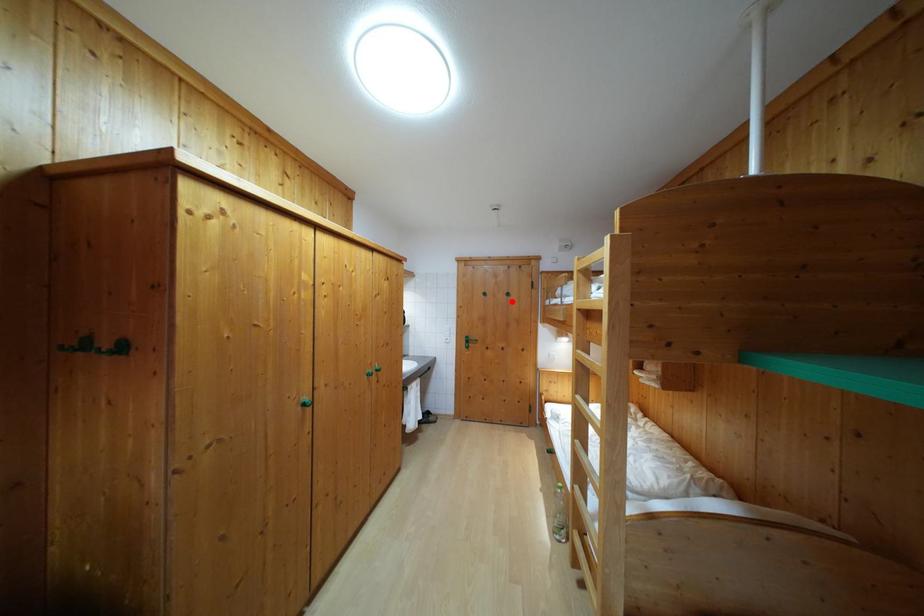
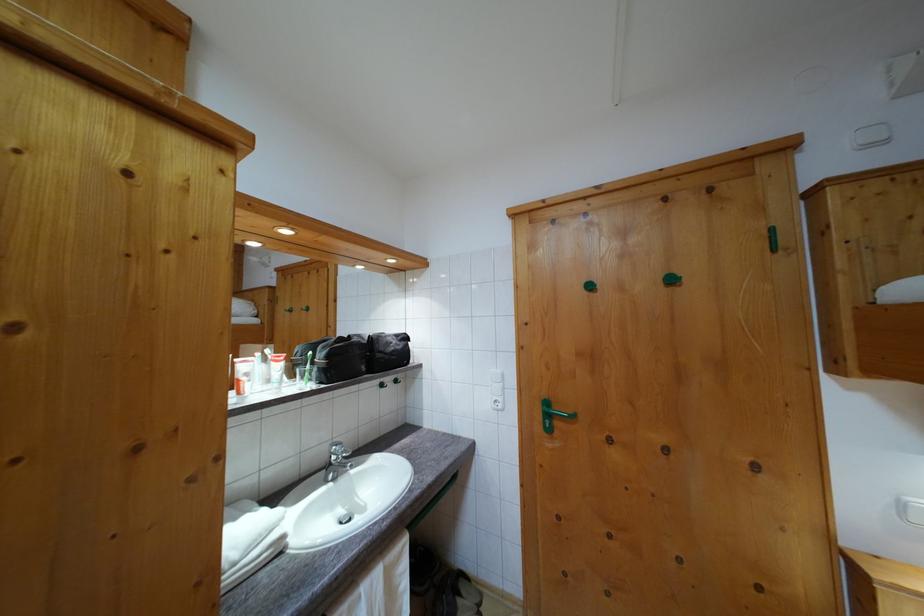
In the second image, find the point that corresponds to the highlighted location in the first image.

(675, 286)